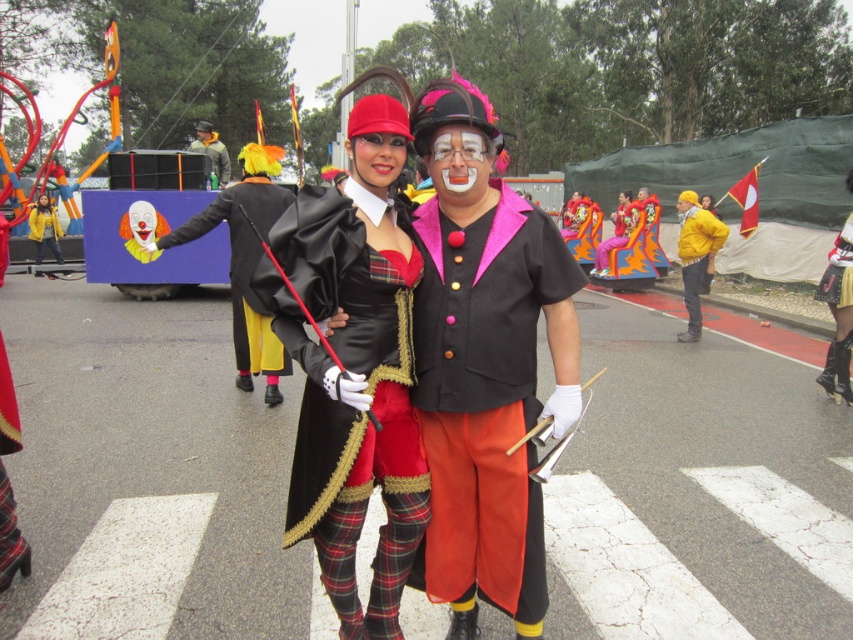
Which is more to the left, matte clown face at center or matte yellow clown nose at center?

matte clown face at center

Which is more to the right, matte clown face at center or matte yellow clown nose at center?

Positioned to the right is matte yellow clown nose at center.

Image resolution: width=853 pixels, height=640 pixels. What do you see at coordinates (459, 163) in the screenshot?
I see `matte clown face at center` at bounding box center [459, 163].

The height and width of the screenshot is (640, 853). In order to click on matte clown face at center in this screenshot , I will do `click(459, 163)`.

Is brushed metal helmet at upper center above matte black clown mask at center?

Indeed, brushed metal helmet at upper center is positioned over matte black clown mask at center.

Find the location of a particular element. The width and height of the screenshot is (853, 640). brushed metal helmet at upper center is located at coordinates (212, 154).

Identify the location of brushed metal helmet at upper center. (212, 154).

Can you confirm if matte black clown mask at center is shorter than matte yellow clown nose at center?

Incorrect, matte black clown mask at center's height does not fall short of matte yellow clown nose at center's.

Between point (38, 196) and point (677, 196), which one is positioned behind?

Point (38, 196)

Image resolution: width=853 pixels, height=640 pixels. In order to click on matte black clown mask at center in this screenshot , I will do `click(44, 202)`.